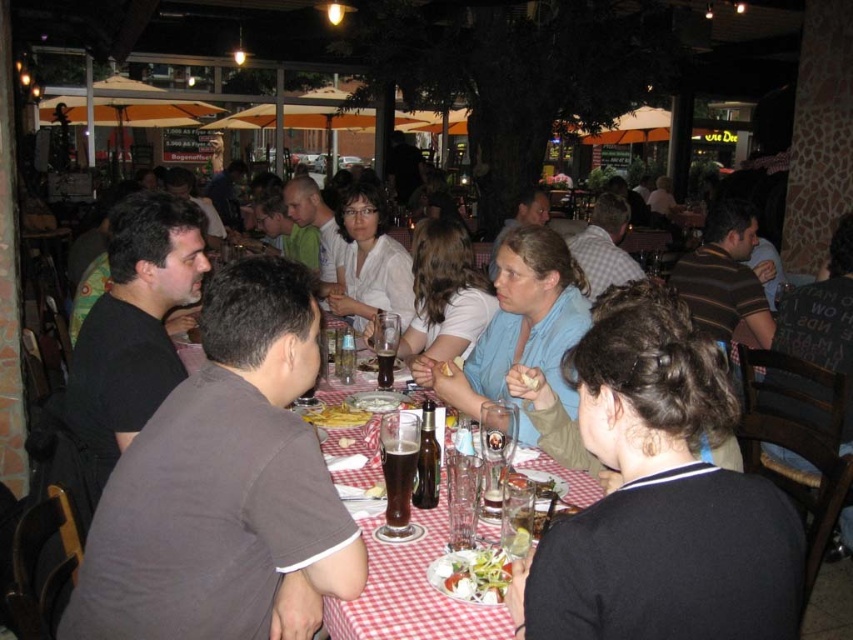
You are a server at the restaurant and need to place a new order of smooth white bread at center on the table. However, there is already a dark blue sweater at center occupying space. Can the bread fit next to the sweater without moving it?

The dark blue sweater at center is wider than the smooth white bread at center, so the bread can fit next to it without moving the sweater since there is enough space available.

You are a customer at the restaurant and want to order a salad. The server points to a spot on the menu at point (473, 573). Where exactly is the salad located on the menu?

The salad is located at point (473, 573) on the menu.

You are a photographer trying to capture a candid shot of the dark blue sweater at center without being noticed. The camera you are using has a minimum focusing distance of 30 inches. Can you take the photo from your current position?

The dark blue sweater at center and camera are 33.79 inches apart from each other. Since the minimum focusing distance is 30 inches, you can take the photo from your current position because the distance is within the camera s capability.